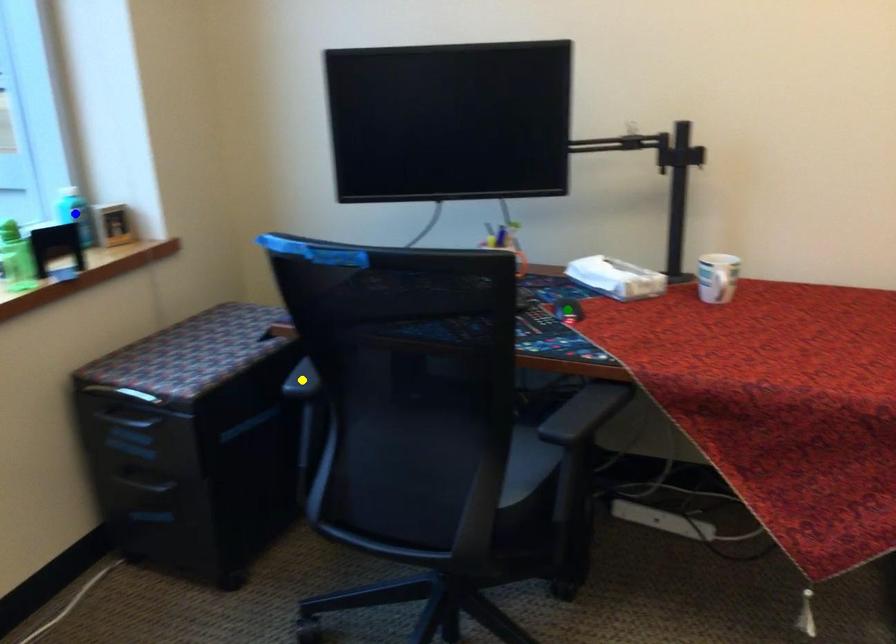
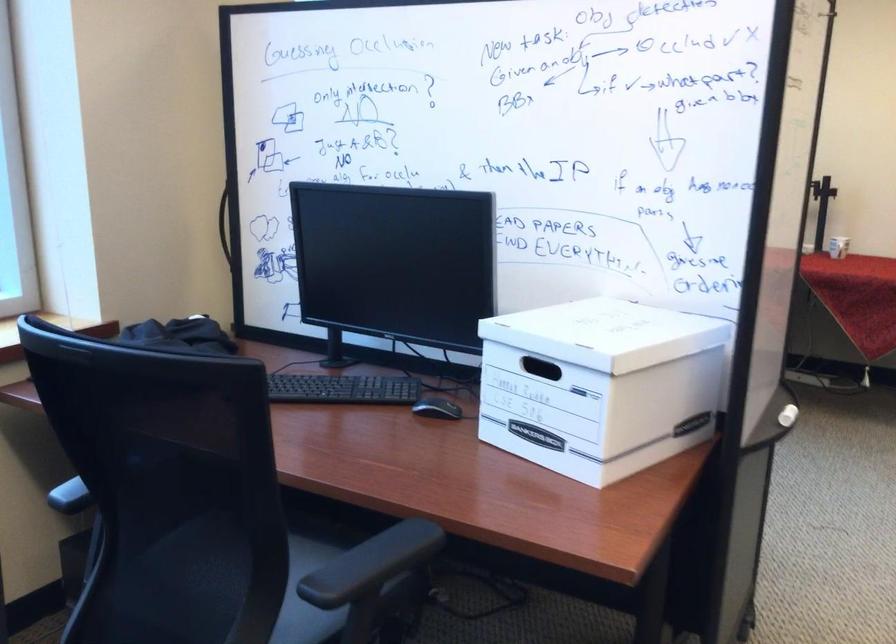
I am providing you with two images of the same scene from different viewpoints. Three points are marked in image1. Which point corresponds to a part or object that is occluded in image2?In image1, three points are marked. Which of them correspond to a part or object that is occluded in image2?Among the three points shown in image1, which one corresponds to a part or object that is no longer visible due to occlusion in image2?

yellow point, green point, blue point cannot be seen in image2.